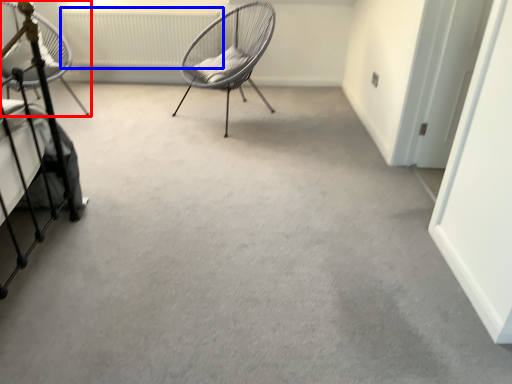
Question: Which of the following is the farthest to the observer, chair (highlighted by a red box) or radiator (highlighted by a blue box)?

Choices:
 (A) chair
 (B) radiator

Answer: (B)